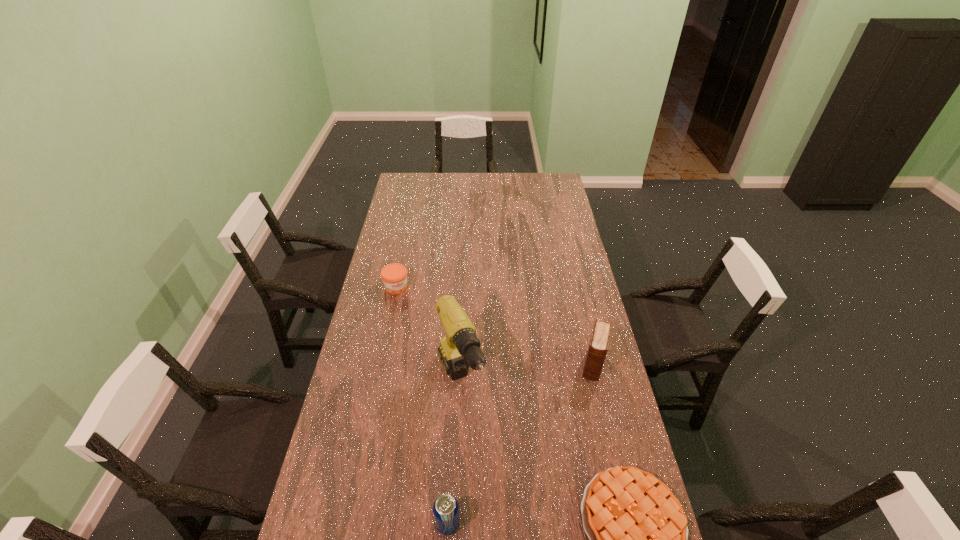
The width and height of the screenshot is (960, 540). I want to click on empty location between the second shortest object and the drill, so pos(428,335).

This screenshot has width=960, height=540. Find the location of `object that is the fourth nearest to the fourth shortest object`. object that is the fourth nearest to the fourth shortest object is located at coordinates [x=394, y=276].

Point out which object is positioned as the nearest to the shortest object. Please provide its 2D coordinates. Your answer should be formatted as a tuple, i.e. [(x, y)], where the tuple contains the x and y coordinates of a point satisfying the conditions above.

[(460, 349)]

You are a GUI agent. You are given a task and a screenshot of the screen. Output one action in this format:
    pyautogui.click(x=<x>, y=<y>)
    Task: Click on the vacant space that satisfies the following two spatial constraints: 1. on the back side of the third shortest object; 2. on the right side of the tallest object
    The width and height of the screenshot is (960, 540).
    Given the screenshot: What is the action you would take?
    pyautogui.click(x=455, y=383)

The height and width of the screenshot is (540, 960). Find the location of `vacant space that satisfies the following two spatial constraints: 1. on the back side of the beer can; 2. on the right side of the diary`. vacant space that satisfies the following two spatial constraints: 1. on the back side of the beer can; 2. on the right side of the diary is located at coordinates (456, 365).